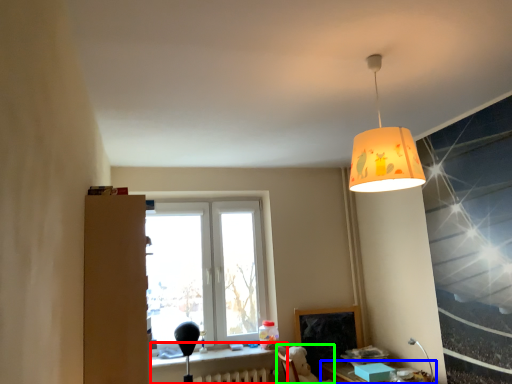
Question: Which object is the closest to the table (highlighted by a red box)? Choose among these: table (highlighted by a blue box) or swivel chair (highlighted by a green box).

Choices:
 (A) table
 (B) swivel chair

Answer: (B)